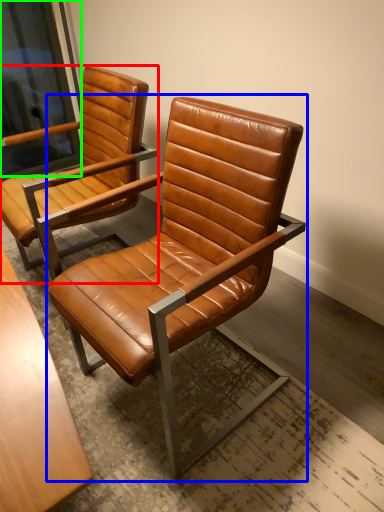
Question: Which is farther away from chair (highlighted by a red box)? chair (highlighted by a blue box) or window screen (highlighted by a green box)?

Choices:
 (A) chair
 (B) window screen

Answer: (B)